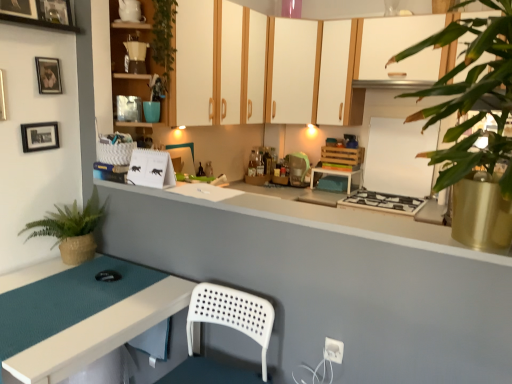
This screenshot has height=384, width=512. In order to click on free spot above white glossy stove at center, the 2th appliance positioned from the top (from a real-world perspective) in this screenshot , I will do `click(396, 116)`.